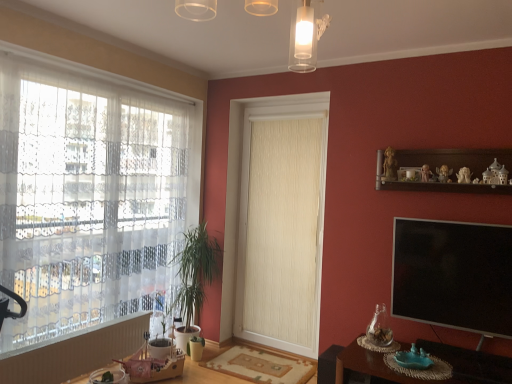
Measure the distance between brown wooden table at lower right and camera.

2.53 meters.

Locate an element on the screen. This screenshot has height=384, width=512. white textured radiator at lower left is located at coordinates (74, 352).

Looking at this image, measure the distance between white lace curtain at left and camera.

white lace curtain at left and camera are 2.57 meters apart.

Where is `translucent glass light fixture at upper center`? This screenshot has height=384, width=512. translucent glass light fixture at upper center is located at coordinates (306, 35).

Find the location of a particular element. The width and height of the screenshot is (512, 384). light fixture positioned vertically above the green leafy plant at left (from a real-world perspective) is located at coordinates (306, 35).

Can you see green leafy plant at left touching translucent glass light fixture at upper center?

No, green leafy plant at left is not next to translucent glass light fixture at upper center.

Considering the sizes of objects green leafy plant at left and translucent glass light fixture at upper center in the image provided, who is thinner, green leafy plant at left or translucent glass light fixture at upper center?

With smaller width is green leafy plant at left.

Is translucent glass light fixture at upper center taller than white lace curtain at left?

No, translucent glass light fixture at upper center is not taller than white lace curtain at left.

Where is `window below the translucent glass light fixture at upper center (from the image's perspective)`? This screenshot has width=512, height=384. window below the translucent glass light fixture at upper center (from the image's perspective) is located at coordinates (91, 195).

Is translucent glass light fixture at upper center placed right next to white lace curtain at left?

No.

From the image's perspective, which is below, translucent glass light fixture at upper center or white lace curtain at left?

white lace curtain at left, from the image's perspective.

Considering the sizes of objects beige textured curtain at center and wooden round table at lower left in the image provided, who is shorter, beige textured curtain at center or wooden round table at lower left?

With less height is wooden round table at lower left.

Which object is thinner, beige textured curtain at center or wooden round table at lower left?

With smaller width is beige textured curtain at center.

Does beige textured curtain at center have a smaller size compared to wooden round table at lower left?

Actually, beige textured curtain at center might be larger than wooden round table at lower left.

Could you tell me if white lace curtain at left is turned towards wooden round table at lower left?

No, white lace curtain at left is not aimed at wooden round table at lower left.

Does point (77, 74) appear closer or farther from the camera than point (125, 359)?

Point (77, 74) appears to be closer to the viewer than point (125, 359).

What's the angular difference between white lace curtain at left and wooden round table at lower left's facing directions?

There is a 1.32-degree angle between the facing directions of white lace curtain at left and wooden round table at lower left.

From a real-world perspective, is white lace curtain at left located higher than wooden round table at lower left?

Correct, in the physical world, white lace curtain at left is higher than wooden round table at lower left.

Looking at this image, is white textured radiator at lower left spatially inside green leafy plant at left, or outside of it?

white textured radiator at lower left is not enclosed by green leafy plant at left.

Considering the positions of objects white textured radiator at lower left and green leafy plant at left in the image provided, who is more to the right, white textured radiator at lower left or green leafy plant at left?

From the viewer's perspective, green leafy plant at left appears more on the right side.

From a real-world perspective, is white textured radiator at lower left physically above green leafy plant at left?

No.

In the scene shown: Considering the sizes of objects brown wooden table at lower right and wooden shelf at upper right in the image provided, who is bigger, brown wooden table at lower right or wooden shelf at upper right?

brown wooden table at lower right is bigger.

Which is farther from the camera, (473, 355) or (478, 155)?

The point (478, 155) is more distant.

Can you tell me how much brown wooden table at lower right and wooden shelf at upper right differ in facing direction?

The facing directions of brown wooden table at lower right and wooden shelf at upper right are 4.79e-05 degrees apart.

Considering the positions of objects brown wooden table at lower right and wooden shelf at upper right in the image provided, who is more to the left, brown wooden table at lower right or wooden shelf at upper right?

Positioned to the left is brown wooden table at lower right.

In the scene shown: Could you tell me if translucent glass light fixture at upper center is facing black glossy tv at right?

No, translucent glass light fixture at upper center is not aimed at black glossy tv at right.

In the scene shown: From the image's perspective, is translucent glass light fixture at upper center under black glossy tv at right?

Actually, translucent glass light fixture at upper center appears above black glossy tv at right in the image.

Is translucent glass light fixture at upper center not inside black glossy tv at right?

Yes.

This screenshot has height=384, width=512. In order to click on light fixture above the black glossy tv at right (from the image's perspective) in this screenshot , I will do `click(306, 35)`.

Locate an element on the screen. Image resolution: width=512 pixels, height=384 pixels. light fixture in front of the green leafy plant at left is located at coordinates coord(306,35).

The image size is (512, 384). I want to click on window located behind the translucent glass light fixture at upper center, so click(91, 195).

Estimate the real-world distances between objects in this image. Which object is closer to beige textured curtain at center, wooden round table at lower left or wooden shelf at upper right?

wooden shelf at upper right lies closer to beige textured curtain at center than the other object.

Considering their positions, is wooden shelf at upper right positioned further to black glossy tv at right than brown wooden table at lower right?

wooden shelf at upper right is further to black glossy tv at right.

Based on the photo, when comparing their distances from translucent glass light fixture at upper center, does wooden round table at lower left or green leafy plant at left seem closer?

The object closer to translucent glass light fixture at upper center is green leafy plant at left.

From the image, which object appears to be farther from brown wooden table at lower right, wooden shelf at upper right or beige textured curtain at center?

Based on the image, beige textured curtain at center appears to be further to brown wooden table at lower right.

Looking at the image, which one is located further to wooden round table at lower left, beige textured curtain at center or black glossy tv at right?

black glossy tv at right is positioned further to the anchor wooden round table at lower left.

When comparing their distances from green leafy plant at left, does brown wooden table at lower right or wooden round table at lower left seem further?

Among the two, brown wooden table at lower right is located further to green leafy plant at left.

Based on the photo, when comparing their distances from white lace curtain at left, does brown wooden table at lower right or green leafy plant at left seem further?

brown wooden table at lower right lies further to white lace curtain at left than the other object.

Considering their positions, is beige textured curtain at center positioned closer to brown wooden table at lower right than wooden round table at lower left?

beige textured curtain at center lies closer to brown wooden table at lower right than the other object.

The image size is (512, 384). I want to click on television between translucent glass light fixture at upper center and green leafy plant at left along the z-axis, so click(x=453, y=275).

Where is `curtain between green leafy plant at left and black glossy tv at right in the horizontal direction`? This screenshot has height=384, width=512. curtain between green leafy plant at left and black glossy tv at right in the horizontal direction is located at coordinates (283, 229).

At what (x,y) coordinates should I click in order to perform the action: click on plant between white textured radiator at lower left and black glossy tv at right from left to right. Please return your answer as a coordinate pair (x, y). Looking at the image, I should click on (195, 272).

Locate an element on the screen. The image size is (512, 384). shelf between green leafy plant at left and black glossy tv at right in the horizontal direction is located at coordinates (455, 159).